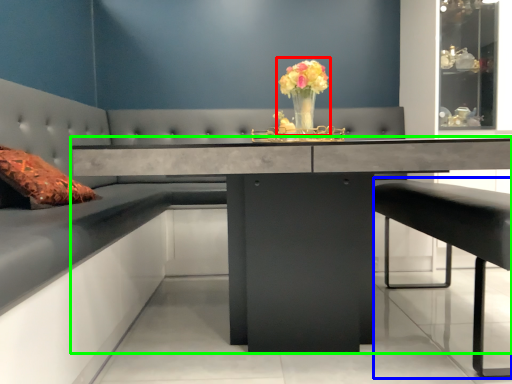
Question: Which is farther away from floral arrangement (highlighted by a red box)? bar stool (highlighted by a blue box) or table (highlighted by a green box)?

Choices:
 (A) bar stool
 (B) table

Answer: (A)